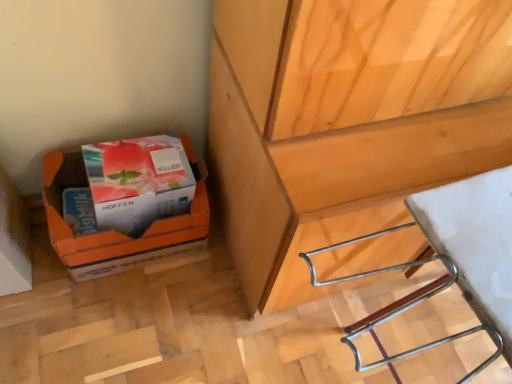
Locate an element on the screen. unoccupied area in front of orange cardboard box at lower left is located at coordinates (105, 312).